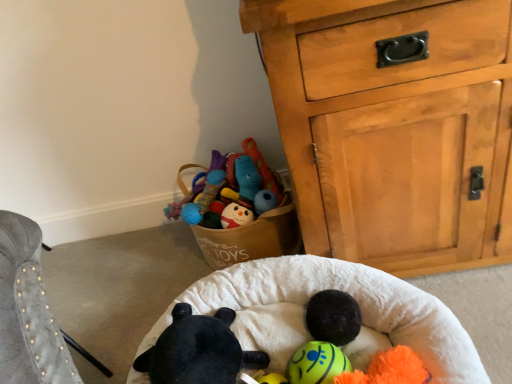
Question: Does white soft infant bed at center have a larger size compared to black plush toy at center, which is the 2th toy in right-to-left order?

Choices:
 (A) yes
 (B) no

Answer: (A)

Question: Is white soft infant bed at center outside of black plush toy at center, which is the 2th toy in right-to-left order?

Choices:
 (A) no
 (B) yes

Answer: (B)

Question: Are white soft infant bed at center and black plush toy at center, which is the 2th toy in right-to-left order, located far from each other?

Choices:
 (A) no
 (B) yes

Answer: (A)

Question: Is white soft infant bed at center oriented towards black plush toy at center, acting as the 1th toy starting from the left?

Choices:
 (A) yes
 (B) no

Answer: (B)

Question: Is white soft infant bed at center turned away from black plush toy at center, which is the 2th toy in right-to-left order?

Choices:
 (A) yes
 (B) no

Answer: (A)

Question: Considering the relative positions of light brown wooden chest of drawers at upper right and neon yellow rubber ball at center, acting as the first toy starting from the right, in the image provided, is light brown wooden chest of drawers at upper right to the left or to the right of neon yellow rubber ball at center, acting as the first toy starting from the right,?

Choices:
 (A) right
 (B) left

Answer: (A)

Question: From their relative heights in the image, would you say light brown wooden chest of drawers at upper right is taller or shorter than neon yellow rubber ball at center, acting as the first toy starting from the right?

Choices:
 (A) tall
 (B) short

Answer: (A)

Question: In terms of size, does light brown wooden chest of drawers at upper right appear bigger or smaller than neon yellow rubber ball at center, which is the 2th toy from left to right?

Choices:
 (A) big
 (B) small

Answer: (A)

Question: Is light brown wooden chest of drawers at upper right wider or thinner than neon yellow rubber ball at center, which is the 2th toy from left to right?

Choices:
 (A) wide
 (B) thin

Answer: (A)

Question: Is black plush toy at center, which is the 2th toy in right-to-left order, situated inside neon yellow rubber ball at center, which is the 2th toy from left to right, or outside?

Choices:
 (A) inside
 (B) outside

Answer: (B)

Question: From a real-world perspective, is black plush toy at center, acting as the 1th toy starting from the left, physically located above or below neon yellow rubber ball at center, which is the 2th toy from left to right?

Choices:
 (A) below
 (B) above

Answer: (B)

Question: From the image's perspective, is black plush toy at center, which is the 2th toy in right-to-left order, positioned above or below neon yellow rubber ball at center, acting as the first toy starting from the right?

Choices:
 (A) above
 (B) below

Answer: (A)

Question: Based on their sizes in the image, would you say black plush toy at center, acting as the 1th toy starting from the left, is bigger or smaller than neon yellow rubber ball at center, which is the 2th toy from left to right?

Choices:
 (A) big
 (B) small

Answer: (A)

Question: Relative to white soft infant bed at center, is neon yellow rubber ball at center, acting as the first toy starting from the right, in front or behind?

Choices:
 (A) front
 (B) behind

Answer: (B)

Question: From their relative heights in the image, would you say neon yellow rubber ball at center, acting as the first toy starting from the right, is taller or shorter than white soft infant bed at center?

Choices:
 (A) tall
 (B) short

Answer: (B)